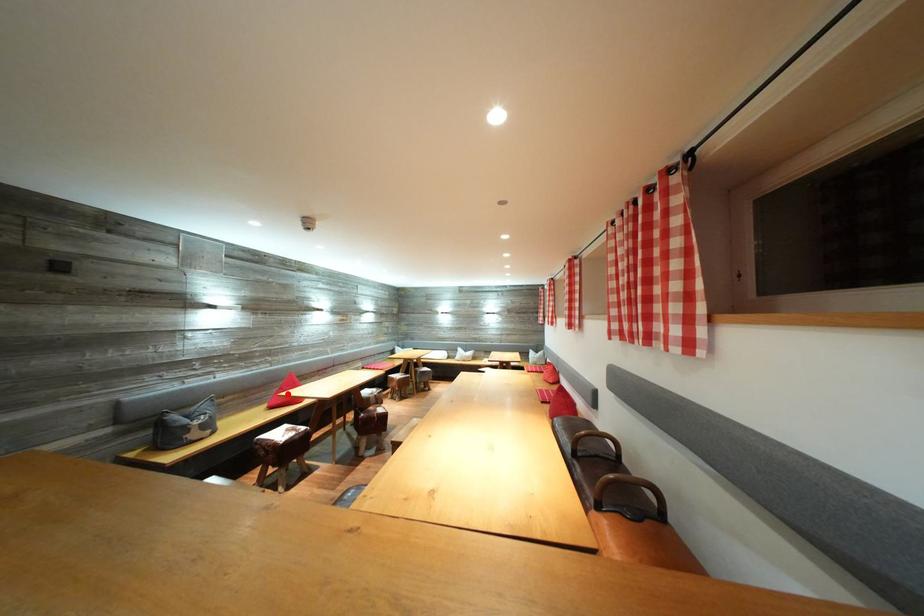
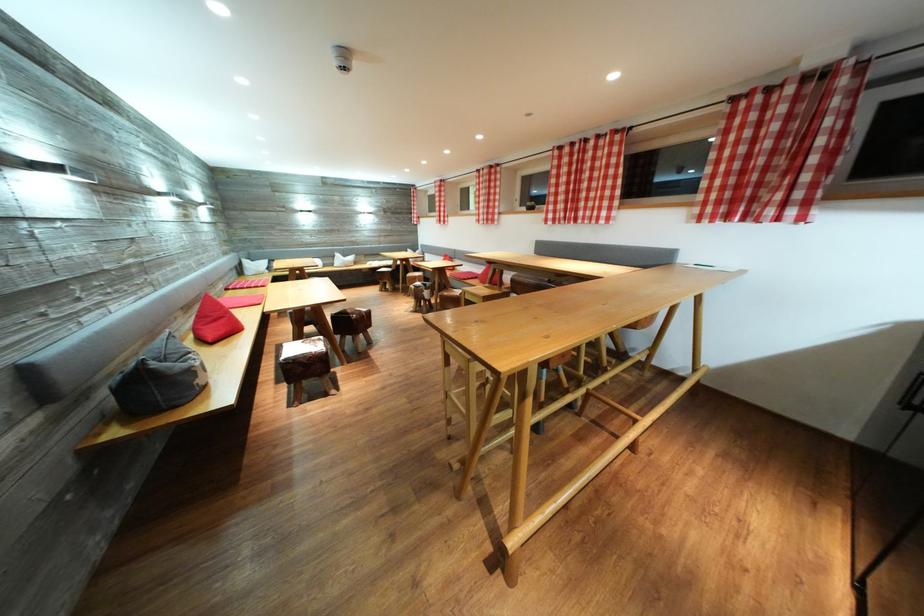
The point at the highlighted location is marked in the first image. Where is the corresponding point in the second image?

(207, 323)